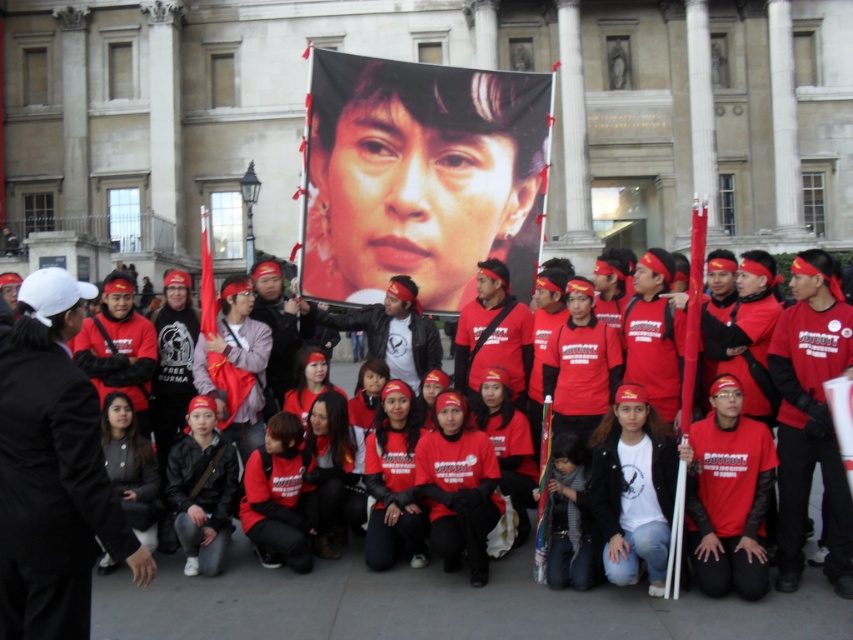
Question: Which of the following is the closest to the observer?

Choices:
 (A) (131, 294)
 (B) (96, 627)
 (C) (47, 547)

Answer: (C)

Question: Which of these objects is positioned closest to the matte black jacket at center?

Choices:
 (A) matte red shirt at center
 (B) matte black banner at upper center

Answer: (B)

Question: Among these points, which one is farthest from the camera?

Choices:
 (A) (114, 388)
 (B) (791, 634)

Answer: (A)

Question: Is matte black jacket at center bigger than matte red shirt at center?

Choices:
 (A) yes
 (B) no

Answer: (B)

Question: From the image, what is the correct spatial relationship of matte black banner at upper center in relation to matte red shirt at center?

Choices:
 (A) below
 (B) above

Answer: (A)

Question: Observing the image, what is the correct spatial positioning of matte black banner at upper center in reference to matte black jacket at center?

Choices:
 (A) above
 (B) below

Answer: (B)